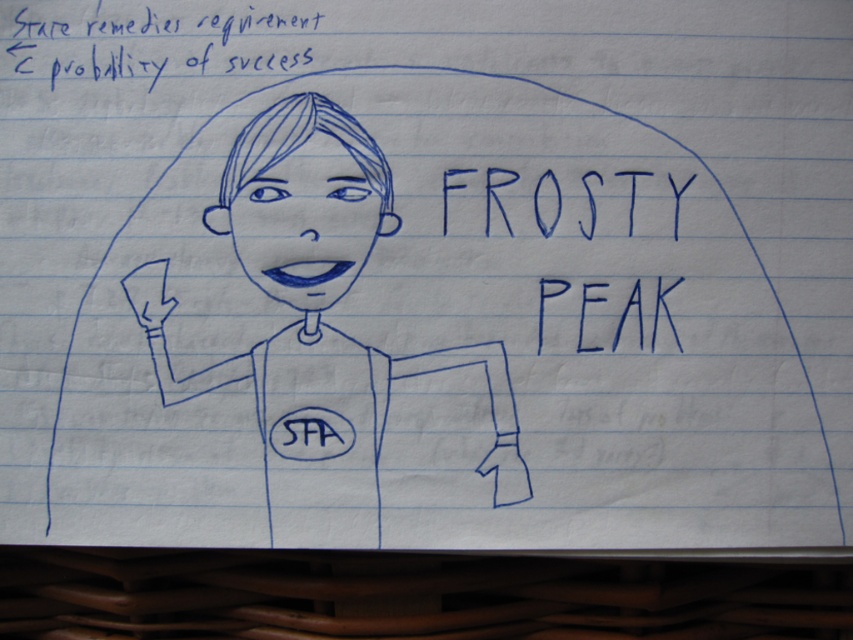
Question: Which point appears closest to the camera in this image?

Choices:
 (A) (279, 186)
 (B) (155, 81)

Answer: (A)

Question: In this image, where is blue line drawing girl at center located relative to blue handwritten text at upper center?

Choices:
 (A) below
 (B) above

Answer: (A)

Question: Which point is closer to the camera?

Choices:
 (A) (453, 278)
 (B) (97, 33)

Answer: (A)

Question: Can you confirm if blue line drawing girl at center is positioned below blue handwritten text at upper center?

Choices:
 (A) yes
 (B) no

Answer: (A)

Question: Does blue line drawing girl at center appear on the right side of blue ink writing at upper left?

Choices:
 (A) yes
 (B) no

Answer: (A)

Question: Which is farther from the blue ink writing at upper left?

Choices:
 (A) blue line drawing girl at center
 (B) blue handwritten text at upper center

Answer: (B)